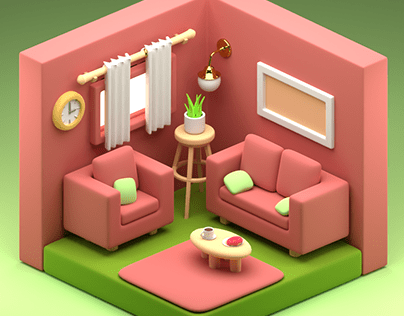
The height and width of the screenshot is (316, 404). In order to click on rectangular white frame in this screenshot , I will do `click(309, 90)`, `click(306, 134)`, `click(329, 129)`, `click(262, 98)`.